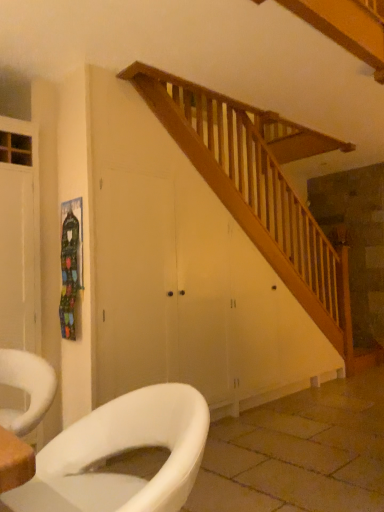
Question: Considering the positions of point (198, 398) and point (340, 478), is point (198, 398) closer or farther from the camera than point (340, 478)?

Choices:
 (A) closer
 (B) farther

Answer: (A)

Question: Is white glossy toilet at lower left taller or shorter than white glossy toilet at lower left?

Choices:
 (A) short
 (B) tall

Answer: (B)

Question: From the image's perspective, relative to white glossy toilet at lower left, is white glossy toilet at lower left above or below?

Choices:
 (A) above
 (B) below

Answer: (A)

Question: Considering the positions of point (377, 467) and point (125, 437), is point (377, 467) closer or farther from the camera than point (125, 437)?

Choices:
 (A) closer
 (B) farther

Answer: (B)

Question: In the image, is white glossy toilet at lower left positioned in front of or behind white glossy toilet at lower left?

Choices:
 (A) behind
 (B) front

Answer: (A)

Question: Based on their positions, is white glossy toilet at lower left located to the left or right of white glossy toilet at lower left?

Choices:
 (A) left
 (B) right

Answer: (B)

Question: Is white glossy toilet at lower left spatially inside white glossy toilet at lower left, or outside of it?

Choices:
 (A) inside
 (B) outside

Answer: (B)